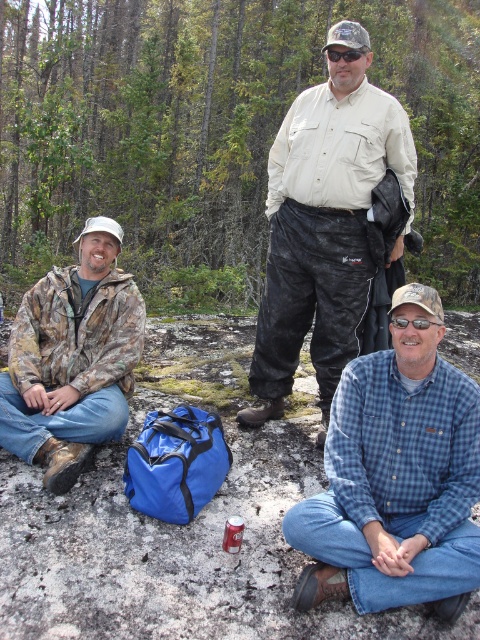
Question: Which object is farther from the camera taking this photo?

Choices:
 (A) khaki cotton shirt at center
 (B) blue plaid shirt at lower right
 (C) camo jacket at left

Answer: (A)

Question: Does blue plaid shirt at lower right appear on the left side of camo jacket at left?

Choices:
 (A) no
 (B) yes

Answer: (A)

Question: Is blue plaid shirt at lower right further to camera compared to camo jacket at left?

Choices:
 (A) no
 (B) yes

Answer: (A)

Question: Which of the following is the farthest from the observer?

Choices:
 (A) blue plaid shirt at lower right
 (B) khaki cotton shirt at center

Answer: (B)

Question: Is blue plaid shirt at lower right to the right of camo jacket at left from the viewer's perspective?

Choices:
 (A) no
 (B) yes

Answer: (B)

Question: Considering the real-world distances, which object is closest to the khaki cotton shirt at center?

Choices:
 (A) camo jacket at left
 (B) blue plaid shirt at lower right

Answer: (A)